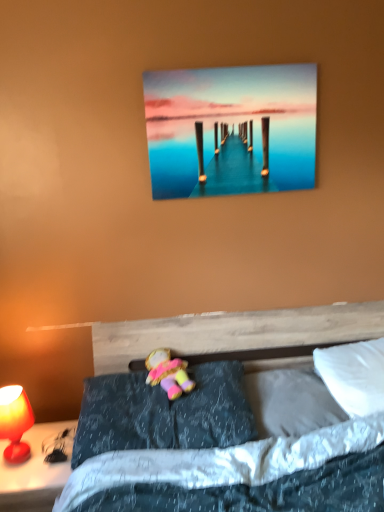
Where is `vacant space underneath matte red lamp at left (from a real-world perspective)`? The height and width of the screenshot is (512, 384). vacant space underneath matte red lamp at left (from a real-world perspective) is located at coordinates (19, 464).